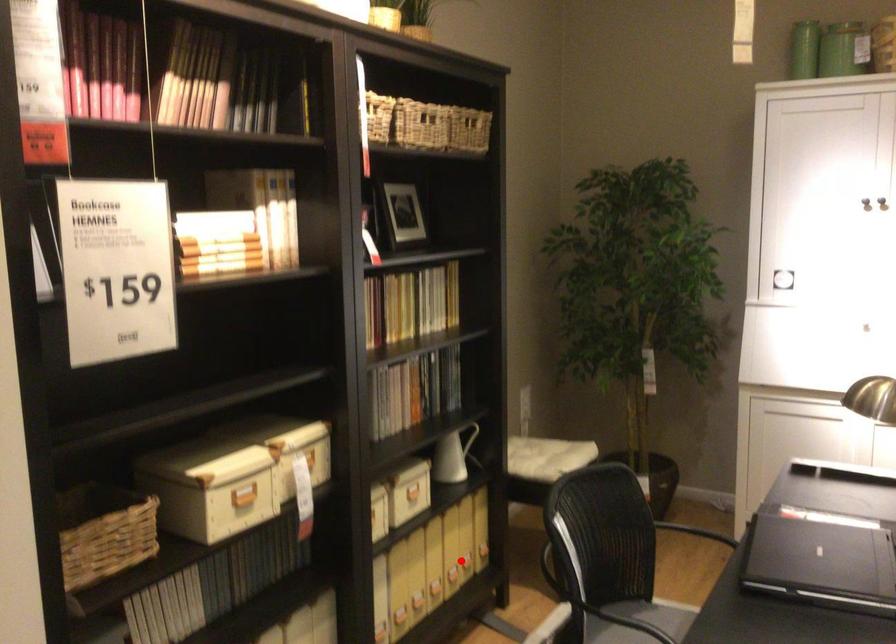
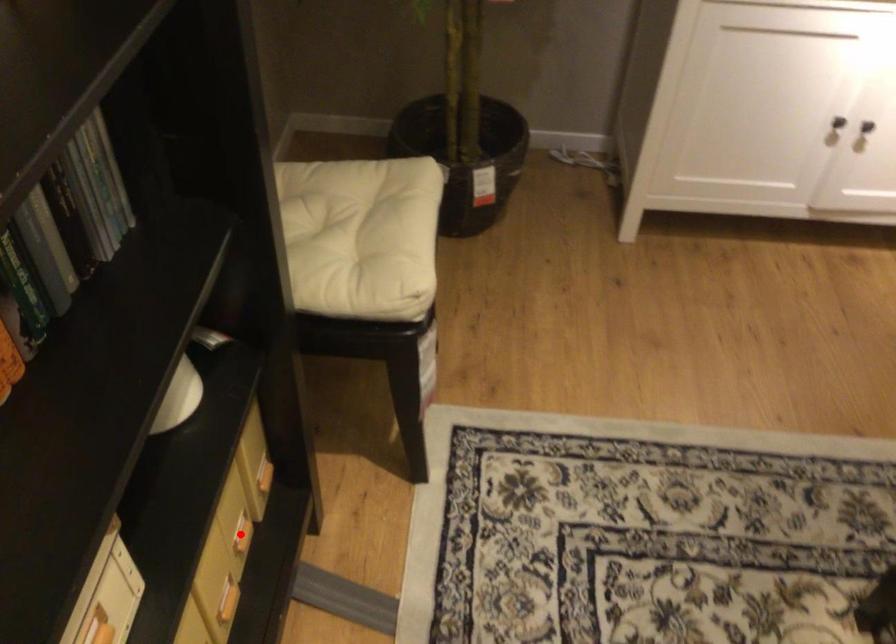
I am providing you with two images of the same scene from different viewpoints. A red point is marked on the first image and another point is marked on the second image. Is the marked point in image1 the same physical position as the marked point in image2?

Yes